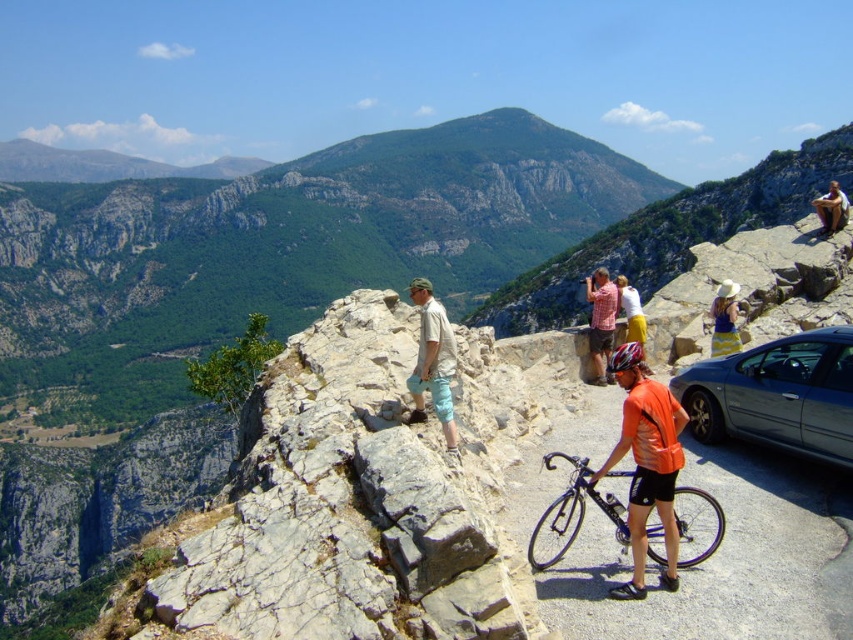
You are standing at the point with coordinates point (413, 400) and want to walk to the point with coordinates point (814, 419). Which direction should you move to get closer to your destination?

To move from point (413, 400) to point (814, 419), you should move upwards since point (814, 419) is closer to the camera than point (413, 400), indicating it is higher in the frame.